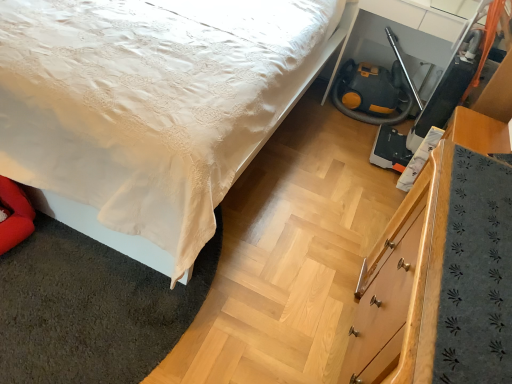
Question: From the image's perspective, would you say yellow rubber fire hose at lower right is positioned over wooden chest of drawers at lower right?

Choices:
 (A) yes
 (B) no

Answer: (A)

Question: From a real-world perspective, does yellow rubber fire hose at lower right stand above wooden chest of drawers at lower right?

Choices:
 (A) yes
 (B) no

Answer: (B)

Question: Is wooden chest of drawers at lower right a part of yellow rubber fire hose at lower right?

Choices:
 (A) yes
 (B) no

Answer: (B)

Question: Can you confirm if yellow rubber fire hose at lower right is thinner than wooden chest of drawers at lower right?

Choices:
 (A) yes
 (B) no

Answer: (B)

Question: Can you confirm if yellow rubber fire hose at lower right is positioned to the left of wooden chest of drawers at lower right?

Choices:
 (A) no
 (B) yes

Answer: (A)

Question: From their relative heights in the image, would you say white satin bed at center is taller or shorter than yellow rubber fire hose at lower right?

Choices:
 (A) tall
 (B) short

Answer: (A)

Question: Based on their positions, is white satin bed at center located to the left or right of yellow rubber fire hose at lower right?

Choices:
 (A) right
 (B) left

Answer: (B)

Question: Is white satin bed at center wider or thinner than yellow rubber fire hose at lower right?

Choices:
 (A) wide
 (B) thin

Answer: (A)

Question: Considering the positions of point (224, 74) and point (361, 92), is point (224, 74) closer or farther from the camera than point (361, 92)?

Choices:
 (A) farther
 (B) closer

Answer: (B)

Question: From the image's perspective, is yellow rubber fire hose at lower right positioned above or below white satin bed at center?

Choices:
 (A) above
 (B) below

Answer: (B)

Question: In terms of width, does yellow rubber fire hose at lower right look wider or thinner when compared to white satin bed at center?

Choices:
 (A) wide
 (B) thin

Answer: (B)

Question: Visually, is yellow rubber fire hose at lower right positioned to the left or to the right of white satin bed at center?

Choices:
 (A) right
 (B) left

Answer: (A)

Question: Is point (340, 97) positioned closer to the camera than point (70, 54)?

Choices:
 (A) farther
 (B) closer

Answer: (A)

Question: Is point (135, 337) positioned closer to the camera than point (111, 82)?

Choices:
 (A) farther
 (B) closer

Answer: (B)

Question: Is white satin bedspread at lower left bigger or smaller than white satin bed at center?

Choices:
 (A) small
 (B) big

Answer: (A)